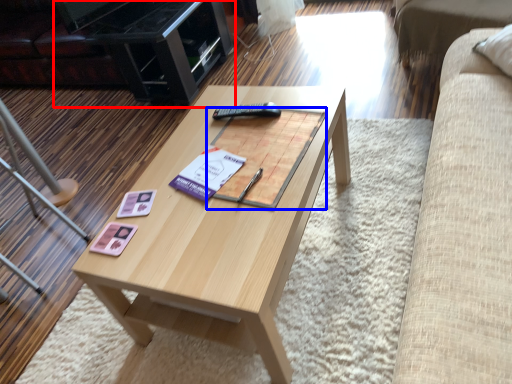
Question: Which point is closer to the camera, entertainment center (highlighted by a red box) or magazine (highlighted by a blue box)?

Choices:
 (A) entertainment center
 (B) magazine

Answer: (B)